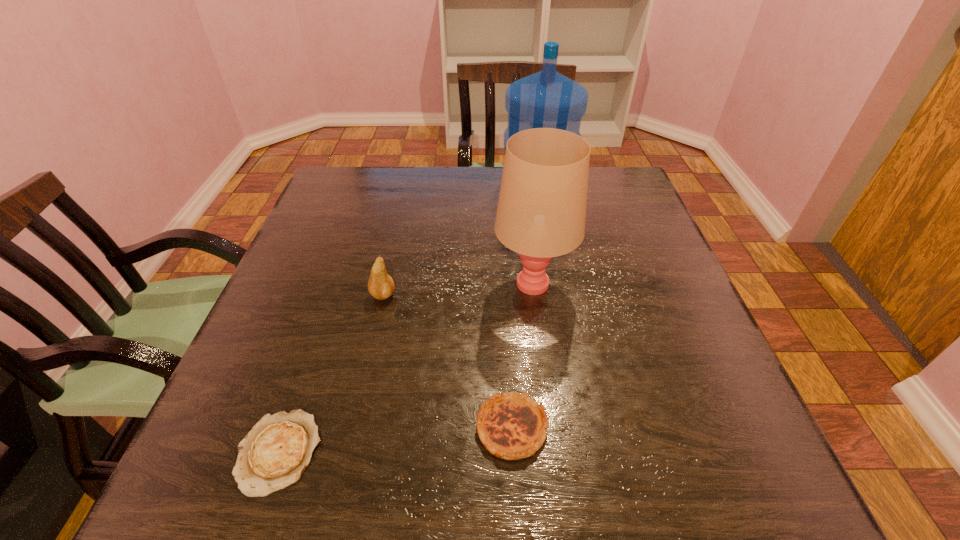
Identify the location of free space located on the back of the pear. (400, 217).

Identify the location of free space located on the back of the taller quiche. (503, 272).

You are a GUI agent. You are given a task and a screenshot of the screen. Output one action in this format:
    pyautogui.click(x=<x>, y=<y>)
    Task: Click on the free space located on the back of the leftmost object
    The image size is (960, 540).
    Given the screenshot: What is the action you would take?
    pyautogui.click(x=328, y=309)

Locate an element on the screen. The height and width of the screenshot is (540, 960). object located at the far edge is located at coordinates (547, 99).

In order to click on object situated at the left edge in this screenshot , I will do `click(273, 455)`.

Identify the location of object that is at the near left corner. Image resolution: width=960 pixels, height=540 pixels. (273, 455).

The height and width of the screenshot is (540, 960). Find the location of `vacant space at the far edge of the desktop`. vacant space at the far edge of the desktop is located at coordinates (487, 208).

Locate an element on the screen. The width and height of the screenshot is (960, 540). vacant space at the near edge is located at coordinates (646, 480).

The height and width of the screenshot is (540, 960). I want to click on free space at the left edge of the desktop, so click(285, 329).

In the image, there is a desktop. At what (x,y) coordinates should I click in order to perform the action: click on vacant space at the right edge. Please return your answer as a coordinate pair (x, y). Looking at the image, I should click on (612, 297).